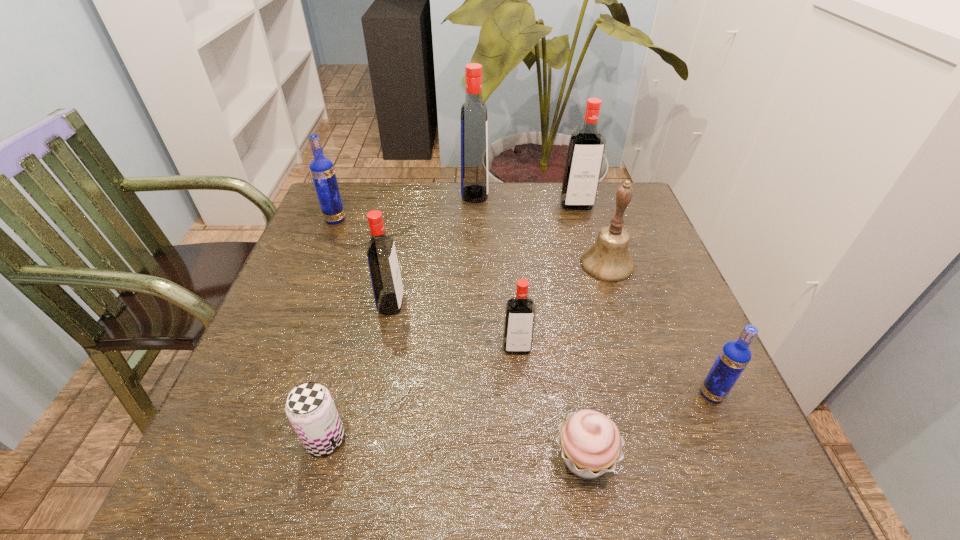
Find the location of a particular element. Image resolution: width=960 pixels, height=540 pixels. vacant space that's between the tallest vodka and the left blue vodka is located at coordinates point(405,206).

Locate an element on the screen. object that is the closest to the second nearest red vodka is located at coordinates (520, 311).

In order to click on object that stands as the closest to the smaller blue vodka in this screenshot , I will do `click(590, 443)`.

This screenshot has width=960, height=540. What are the coordinates of `vodka that is the third nearest to the rightmost red vodka` in the screenshot? It's located at (387, 285).

Select which vodka appears as the fifth closest to the smallest red vodka. Please provide its 2D coordinates. Your answer should be formatted as a tuple, i.e. [(x, y)], where the tuple contains the x and y coordinates of a point satisfying the conditions above.

[(322, 171)]

In order to click on the fourth closest red vodka to the third farthest vodka in this screenshot , I will do `click(586, 148)`.

Locate which red vodka ranks third in proximity to the fourth farthest object. Please provide its 2D coordinates. Your answer should be formatted as a tuple, i.e. [(x, y)], where the tuple contains the x and y coordinates of a point satisfying the conditions above.

[(474, 128)]

This screenshot has width=960, height=540. Find the location of `vacant space that satisfies the following two spatial constraints: 1. on the front side of the fourth farthest object; 2. on the front and back of the third farthest red vodka`. vacant space that satisfies the following two spatial constraints: 1. on the front side of the fourth farthest object; 2. on the front and back of the third farthest red vodka is located at coordinates (620, 304).

Image resolution: width=960 pixels, height=540 pixels. I want to click on free spot that satisfies the following two spatial constraints: 1. on the front and back of the sixth nearest object; 2. on the right side of the biggest red vodka, so click(473, 264).

Locate an element on the screen. This screenshot has width=960, height=540. free space in the image that satisfies the following two spatial constraints: 1. on the front and back of the fourth nearest object; 2. on the right side of the nearer blue vodka is located at coordinates (520, 394).